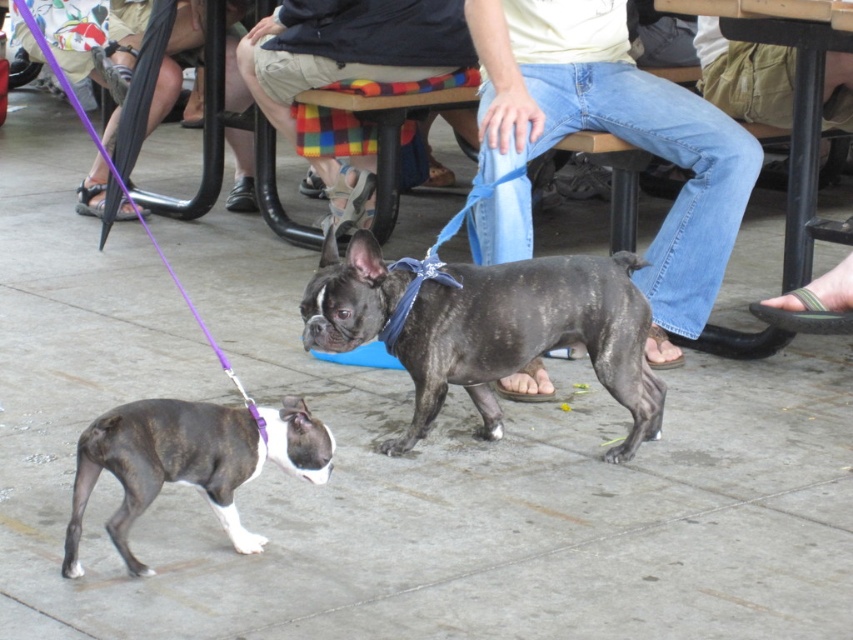
You are at an outdoor event and see two people sitting at a table. One is wearing denim jeans at center and the other is wearing light beige shorts at center. Which clothing item is positioned more to the right?

The denim jeans at center is positioned more to the right than the light beige shorts at center.

You are at an outdoor event and see a shiny black dog at center and light beige shorts at center. Which object is smaller in size?

The shiny black dog at center is smaller in size compared to the light beige shorts at center.